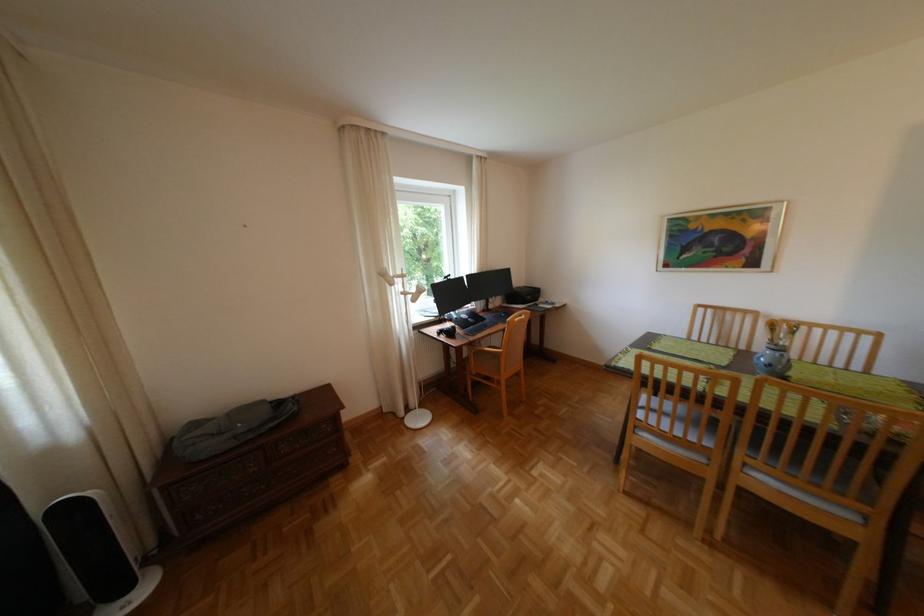
Describe the element at coordinates (400, 284) in the screenshot. The image size is (924, 616). I see `a white lamp head` at that location.